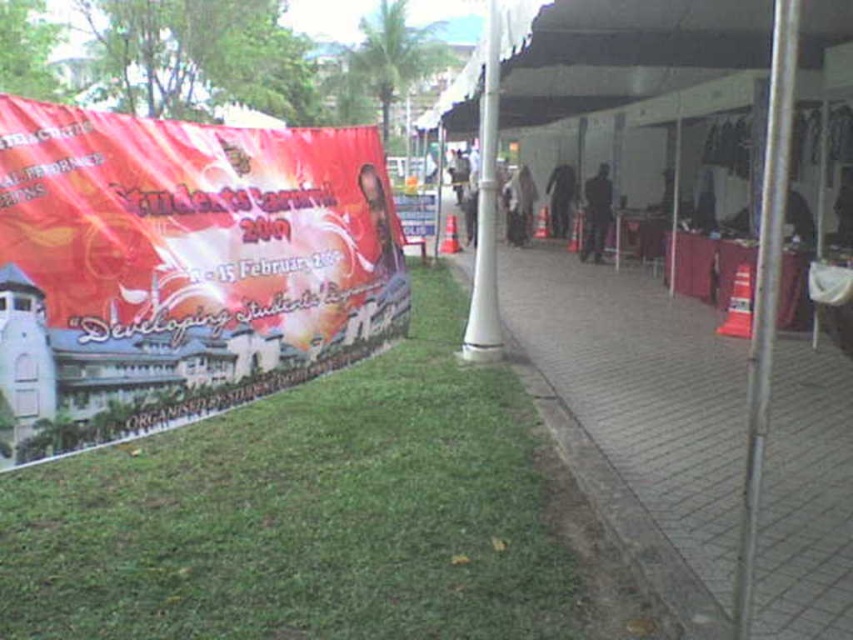
How much distance is there between green grass at lower left and white plastic pole at center?

green grass at lower left is 4.23 meters away from white plastic pole at center.

Can you confirm if green grass at lower left is shorter than white plastic pole at center?

Yes, green grass at lower left is shorter than white plastic pole at center.

Between point (67, 520) and point (486, 99), which one is positioned behind?

Positioned behind is point (486, 99).

Identify the location of green grass at lower left. The height and width of the screenshot is (640, 853). (306, 515).

Who is more distant from viewer, (753, 605) or (490, 280)?

The point (490, 280) is more distant.

Is brick paved sidewalk at center taller than white plastic pole at center?

Indeed, brick paved sidewalk at center has a greater height compared to white plastic pole at center.

Is point (801, 371) positioned after point (498, 42)?

That is True.

Where is `brick paved sidewalk at center`? The image size is (853, 640). brick paved sidewalk at center is located at coordinates (642, 410).

Between green grass at lower left and brick paved sidewalk at center, which one appears on the left side from the viewer's perspective?

From the viewer's perspective, green grass at lower left appears more on the left side.

Which is behind, point (386, 428) or point (590, 362)?

Positioned behind is point (590, 362).

This screenshot has width=853, height=640. Find the location of `green grass at lower left`. green grass at lower left is located at coordinates (306, 515).